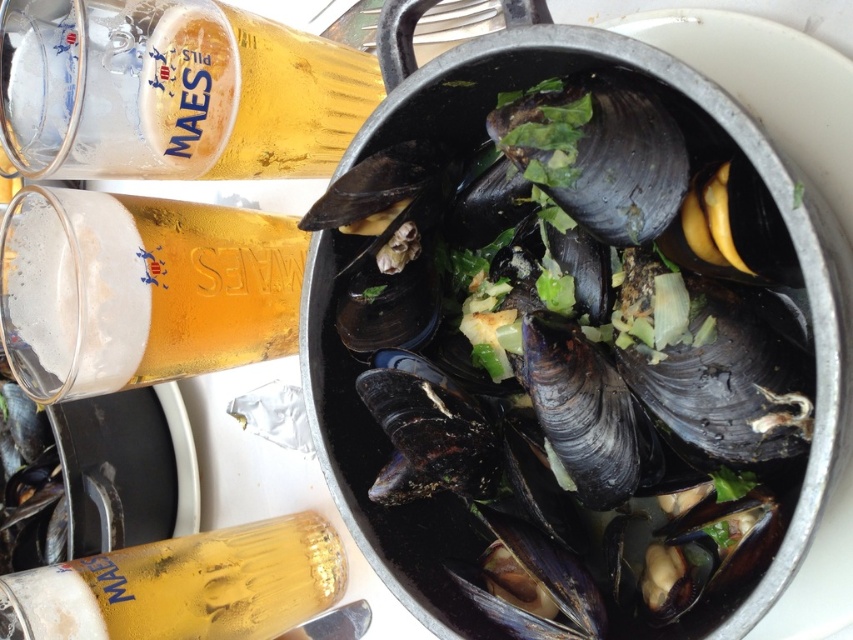
Is translucent glass beer at upper left shorter than foamy golden beer at upper left?

Yes, translucent glass beer at upper left is shorter than foamy golden beer at upper left.

Who is shorter, translucent glass beer at upper left or foamy golden beer at upper left?

With less height is translucent glass beer at upper left.

Is point (135, 129) farther from viewer compared to point (28, 266)?

No, (135, 129) is in front of (28, 266).

The height and width of the screenshot is (640, 853). I want to click on translucent glass beer at upper left, so click(177, 92).

Does translucent glass beer at upper left appear on the left side of translucent glass bottle at lower left?

No, translucent glass beer at upper left is not to the left of translucent glass bottle at lower left.

Is point (260, 26) more distant than point (10, 596)?

Yes, it is.

Does point (166, 129) lie in front of point (286, 602)?

Yes, point (166, 129) is closer to viewer.

Find the location of a particular element. The image size is (853, 640). translucent glass beer at upper left is located at coordinates (177, 92).

How much distance is there between glossy dark shellfish at center and foamy golden beer at upper left?

They are 20.76 centimeters apart.

The width and height of the screenshot is (853, 640). Identify the location of glossy dark shellfish at center. (402, 346).

Which is in front, point (715, 396) or point (73, 394)?

Point (715, 396)

Find the location of a particular element. glossy dark shellfish at center is located at coordinates (402, 346).